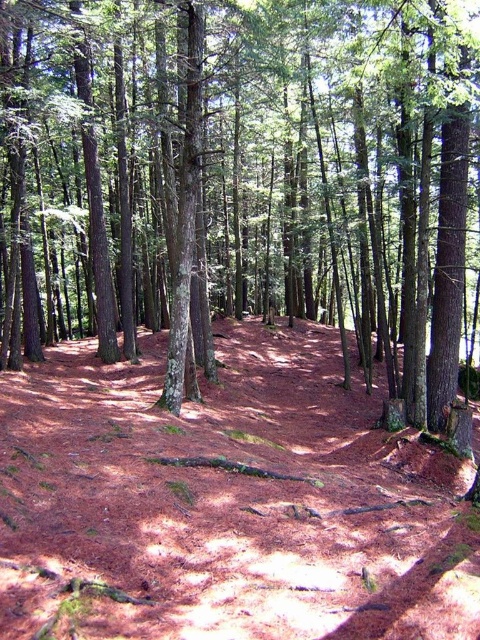
Question: Does brown rough tree at center come behind brown dirt trail at center?

Choices:
 (A) yes
 (B) no

Answer: (A)

Question: Which point is farther to the camera?

Choices:
 (A) brown rough tree at center
 (B) brown dirt trail at center

Answer: (A)

Question: Is brown rough tree at center closer to camera compared to brown dirt trail at center?

Choices:
 (A) yes
 (B) no

Answer: (B)

Question: Which point is farther to the camera?

Choices:
 (A) brown dirt trail at center
 (B) brown rough tree at center

Answer: (B)

Question: Among these objects, which one is farthest from the camera?

Choices:
 (A) brown dirt trail at center
 (B) brown rough tree at center

Answer: (B)

Question: Can you confirm if brown rough tree at center is positioned to the right of brown dirt trail at center?

Choices:
 (A) no
 (B) yes

Answer: (B)